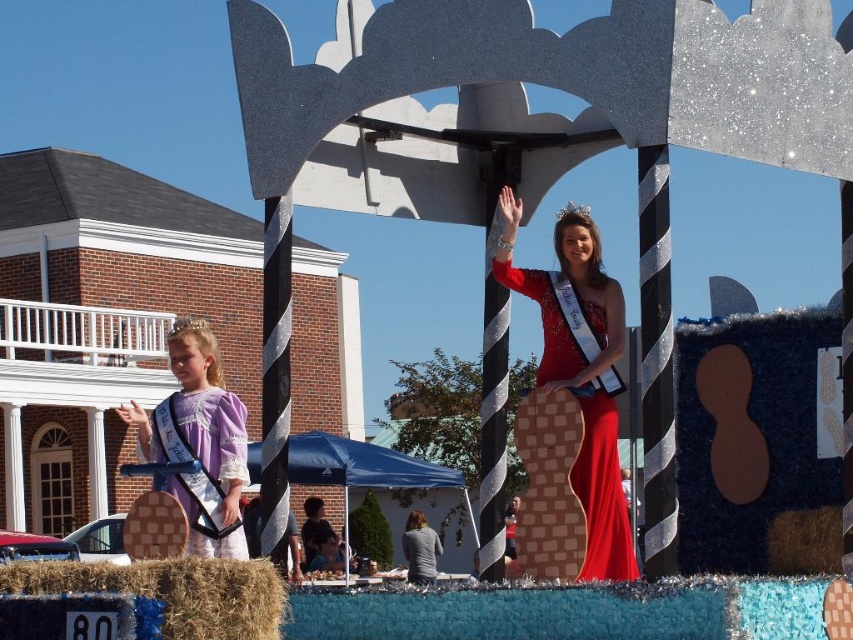
Question: Estimate the real-world distances between objects in this image. Which object is farther from the shiny red dress at center?

Choices:
 (A) brown straw bale at lower left
 (B) purple satin sash at center

Answer: (A)

Question: Does purple satin sash at center appear on the left side of brown straw bale at lower left?

Choices:
 (A) yes
 (B) no

Answer: (A)

Question: Which point is closer to the camera taking this photo?

Choices:
 (A) (190, 602)
 (B) (154, 420)
 (C) (561, 333)

Answer: (A)

Question: Does purple satin sash at center lie behind shiny red dress at center?

Choices:
 (A) yes
 (B) no

Answer: (A)

Question: Among these points, which one is nearest to the camera?

Choices:
 (A) (636, 570)
 (B) (231, 582)

Answer: (B)

Question: Is purple satin sash at center below shiny red dress at center?

Choices:
 (A) yes
 (B) no

Answer: (A)